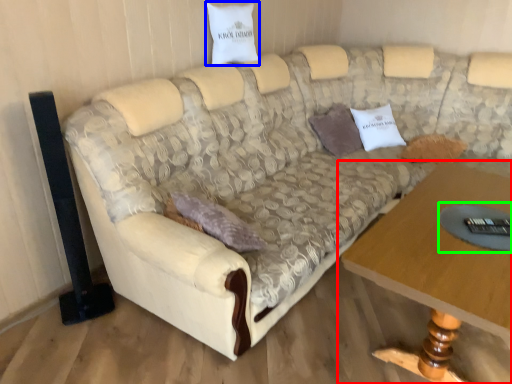
Question: Estimate the real-world distances between objects in this image. Which object is farther from table (highlighted by a red box), pillow (highlighted by a blue box) or glass table (highlighted by a green box)?

Choices:
 (A) pillow
 (B) glass table

Answer: (A)